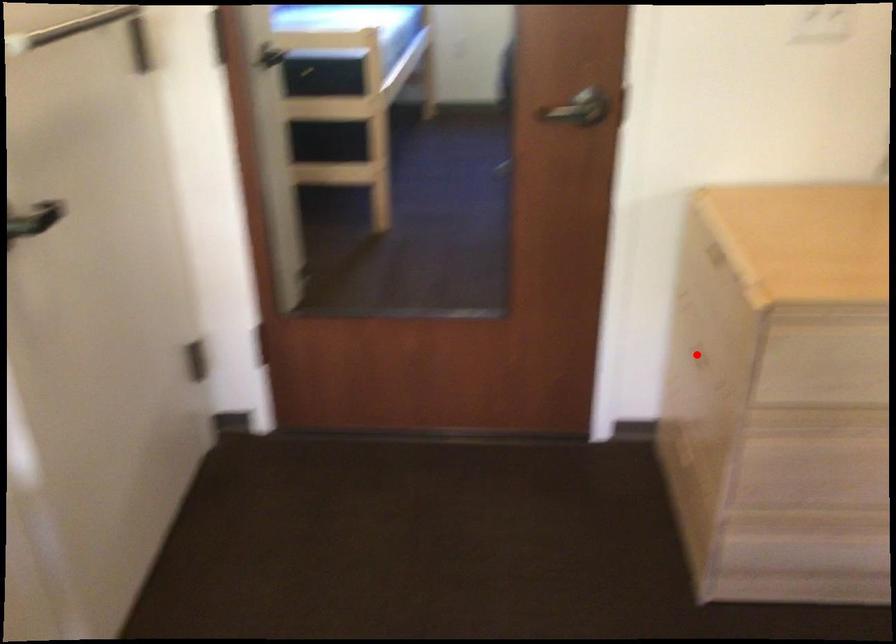
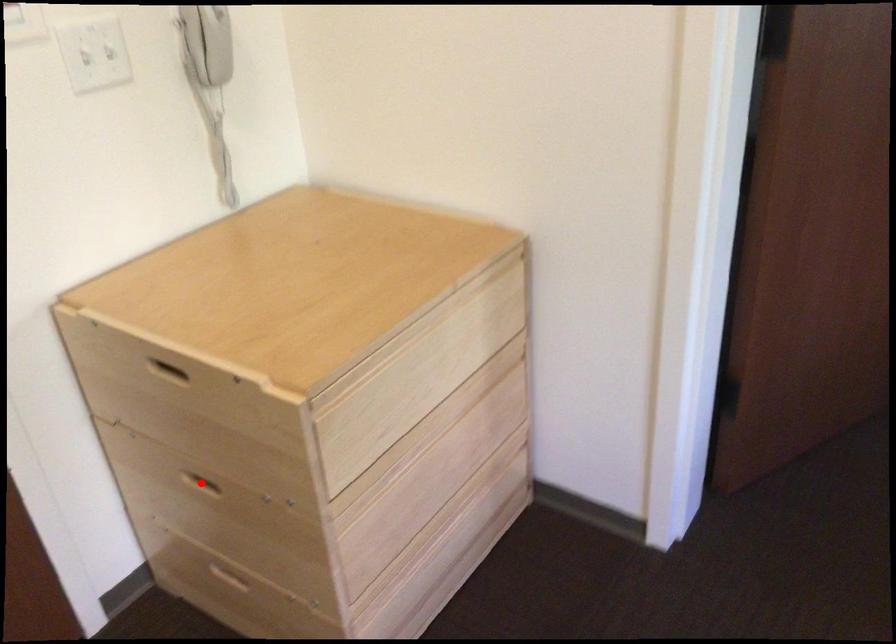
I am providing you with two images of the same scene from different viewpoints. A red point is marked on the first image and another point is marked on the second image. Is the marked point in image1 the same physical position as the marked point in image2?

Yes